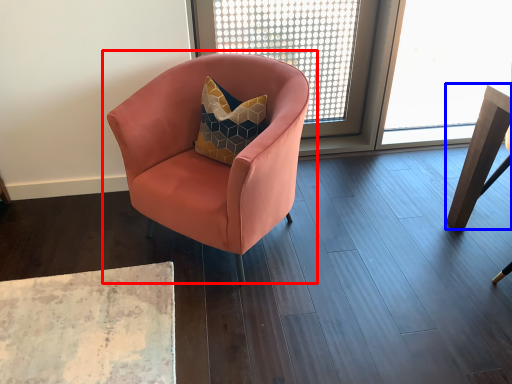
Question: Among these objects, which one is farthest to the camera, chair (highlighted by a red box) or table (highlighted by a blue box)?

Choices:
 (A) chair
 (B) table

Answer: (B)